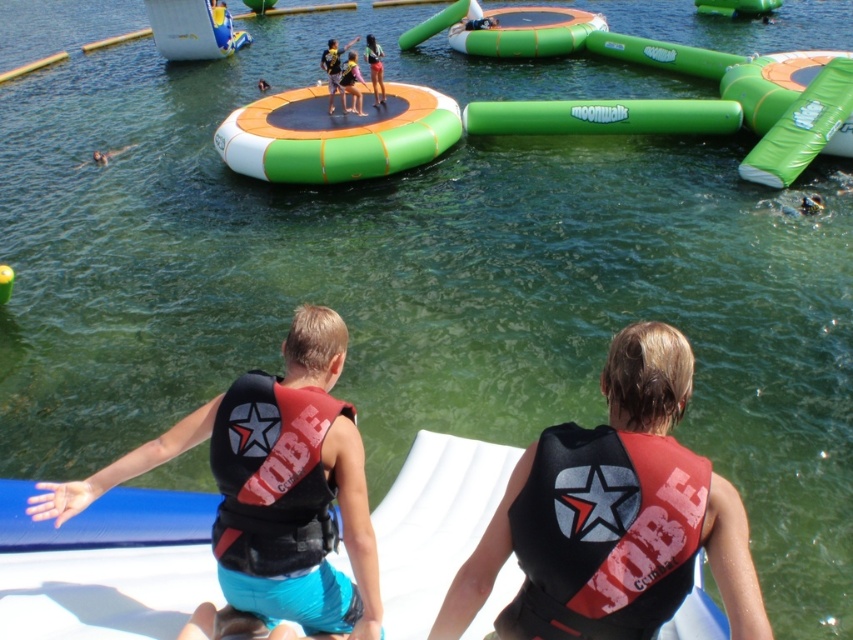
You are a lifeguard standing on the blue glossy boat at upper left and need to reach the brown skin at lower left. Given that you can swim at a speed of 1 meter per second, how many seconds will it take you to reach them?

The distance between the blue glossy boat at upper left and brown skin at lower left is 10.29 meters. At a swimming speed of 1 meter per second, it would take approximately 10.29 seconds to reach them.

Consider the image. You are a lifeguard at the water park. You notice the blue glossy boat at upper left and the brown skin at lower left. Which object is positioned higher in the image?

The blue glossy boat at upper left is positioned higher than the brown skin at lower left.

You are a lifeguard at the water park and need to reach the blue glossy boat at upper left quickly. Based on its coordinates, which direction should you head from the center of the image?

The blue glossy boat at upper left is located at point coordinates, so you should head towards the upper left direction from the center of the image to reach it.